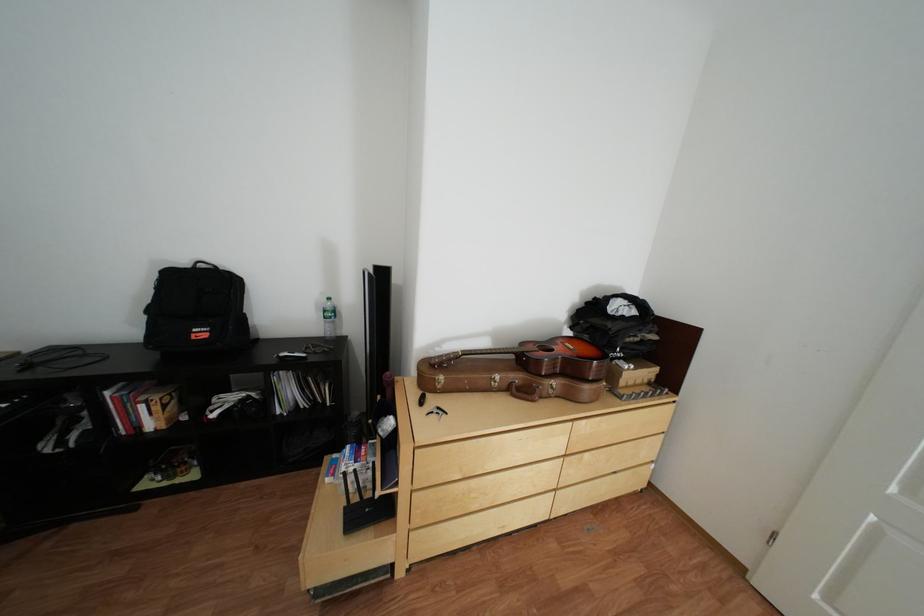
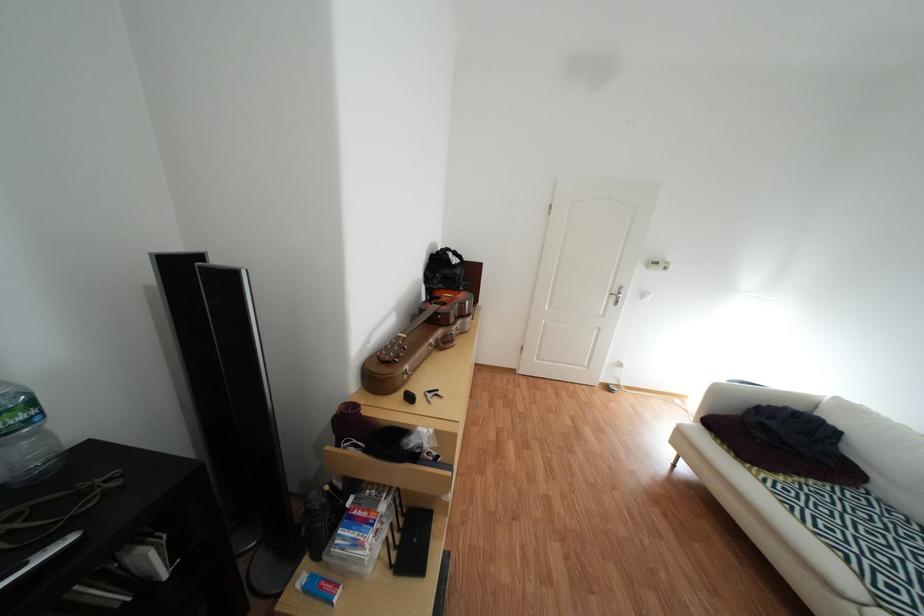
First-person continuous shooting, in which direction is the camera rotating?

The rotation direction of the camera is right-down.